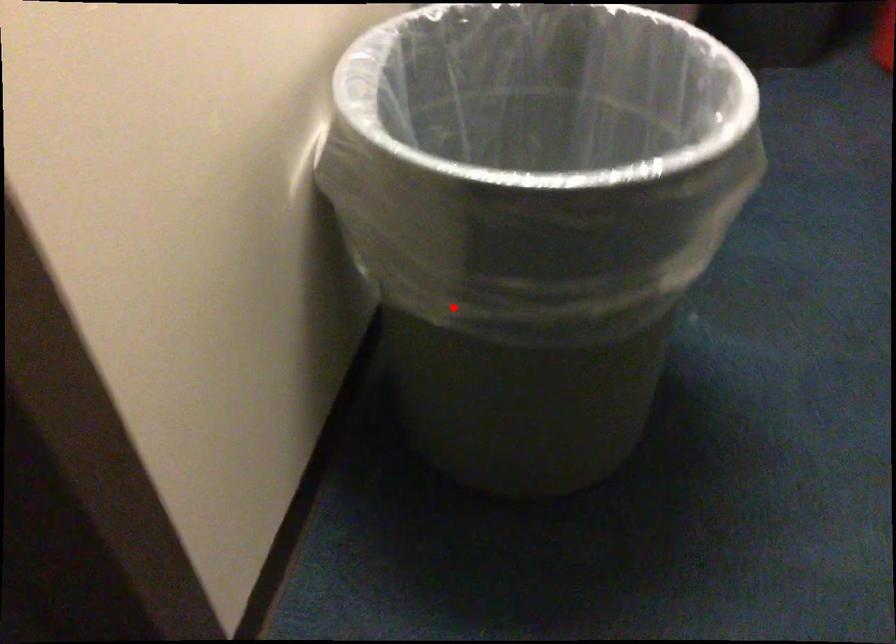
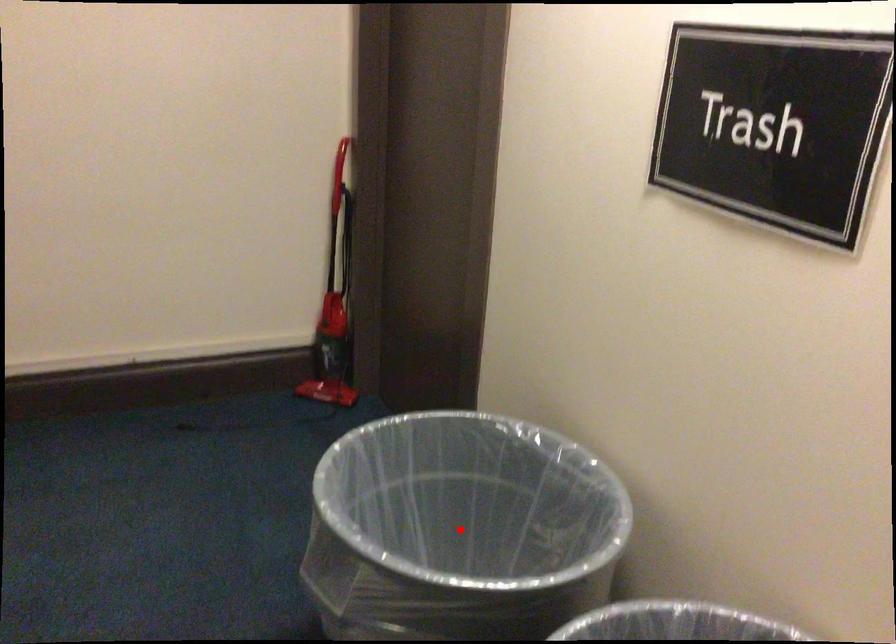
I am providing you with two images of the same scene from different viewpoints. A red point is marked on the first image and another point is marked on the second image. Do the highlighted points in image1 and image2 indicate the same real-world spot?

Yes